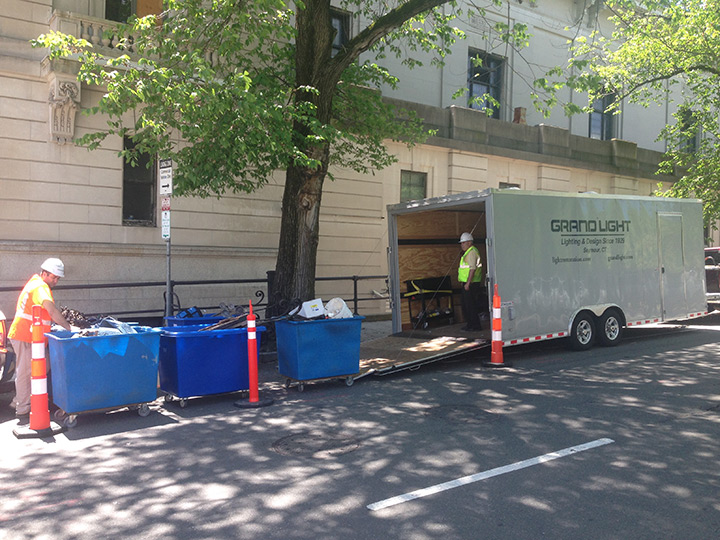
This screenshot has height=540, width=720. I want to click on windows, so click(143, 182), click(114, 6), click(418, 177), click(458, 70), click(346, 33), click(613, 109), click(507, 178), click(695, 130).